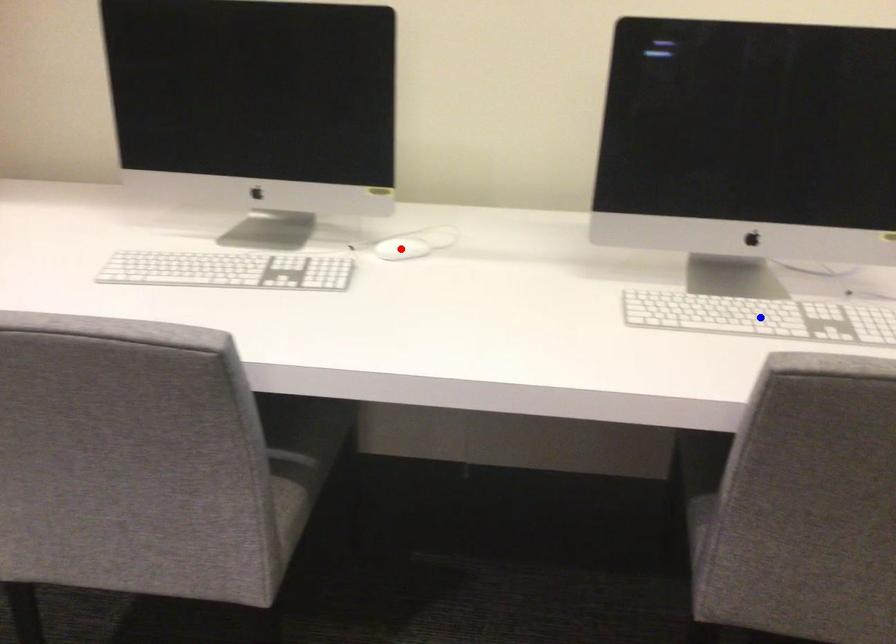
Question: Which of the two points in the image is closer to the camera?

Choices:
 (A) Blue point is closer.
 (B) Red point is closer.

Answer: (A)